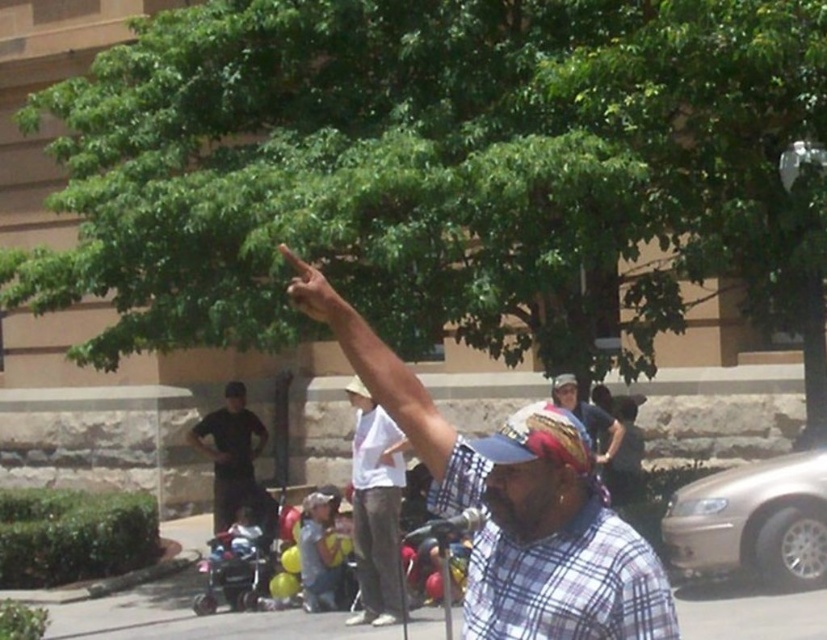
Can you confirm if plaid fabric at center is thinner than white cotton shirt at center?

No.

Does point (646, 561) lie in front of point (398, 602)?

Yes, point (646, 561) is in front of point (398, 602).

You are a GUI agent. You are given a task and a screenshot of the screen. Output one action in this format:
    pyautogui.click(x=<x>, y=<y>)
    Task: Click on the plaid fabric at center
    Image resolution: width=827 pixels, height=640 pixels.
    Given the screenshot: What is the action you would take?
    pyautogui.click(x=567, y=582)

Is point (649, 0) in front of point (213, 481)?

That is True.

Does green leafy tree at upper center have a smaller size compared to dark gray shirt at center?

Yes, green leafy tree at upper center is smaller than dark gray shirt at center.

At what (x,y) coordinates should I click in order to perform the action: click on green leafy tree at upper center. Please return your answer as a coordinate pair (x, y). The height and width of the screenshot is (640, 827). Looking at the image, I should click on (438, 170).

Is plaid fabric at center taller than dark gray shirt at center?

In fact, plaid fabric at center may be shorter than dark gray shirt at center.

Between point (504, 593) and point (259, 433), which one is positioned behind?

Point (259, 433)

This screenshot has width=827, height=640. Find the location of `plaid fabric at center`. plaid fabric at center is located at coordinates click(x=567, y=582).